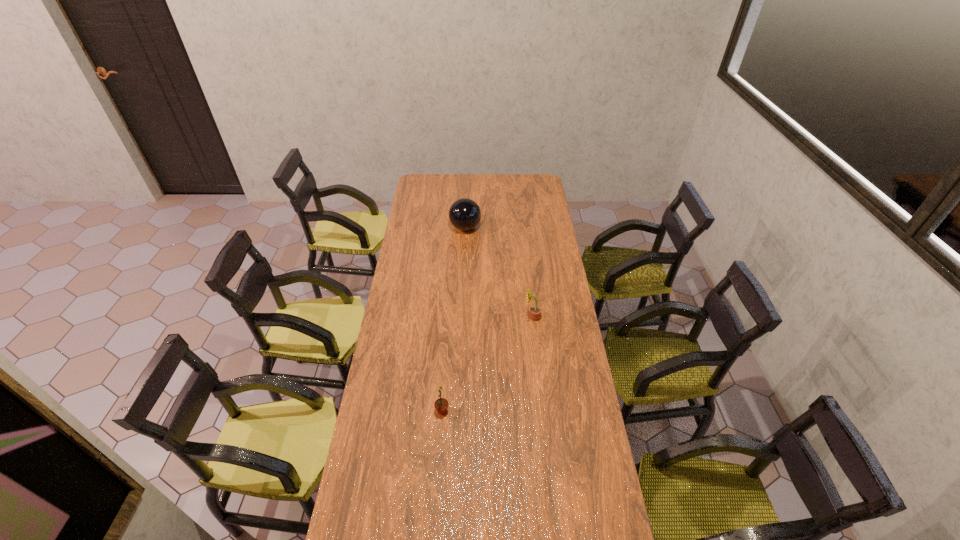
At what (x,y) coordinates should I click in order to perform the action: click on bowling ball. Please return your answer as a coordinate pair (x, y). Looking at the image, I should click on (464, 214).

Find the location of a particular element. The height and width of the screenshot is (540, 960). the right sunflower is located at coordinates (535, 311).

Where is `the rightmost object`? This screenshot has height=540, width=960. the rightmost object is located at coordinates (535, 311).

Locate an element on the screen. This screenshot has width=960, height=540. the nearer sunflower is located at coordinates (441, 404).

The image size is (960, 540). Find the location of `the nearest object`. the nearest object is located at coordinates (441, 404).

Identify the location of free location located on the side of the bowling ball with the finger holes. (496, 228).

In order to click on vacant space located 0.190m on the face of the second nearest object in this screenshot , I will do `click(484, 317)`.

Find the location of `blank space located 0.380m on the face of the second nearest object`. blank space located 0.380m on the face of the second nearest object is located at coordinates (443, 317).

The image size is (960, 540). Find the location of `free space located on the face of the second nearest object`. free space located on the face of the second nearest object is located at coordinates (439, 317).

At what (x,y) coordinates should I click in order to perform the action: click on free spot located on the face of the left sunflower. Please return your answer as a coordinate pair (x, y). The width and height of the screenshot is (960, 540). Looking at the image, I should click on (526, 411).